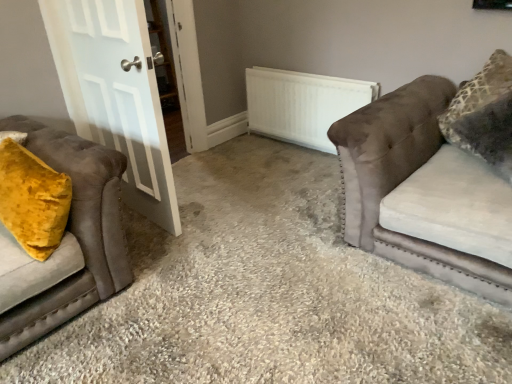
Question: From a real-world perspective, does white matte radiator at center sit lower than velvet mustard pillow at left, the 2th studio couch from the right?

Choices:
 (A) yes
 (B) no

Answer: (A)

Question: Considering the relative positions of white matte radiator at center and velvet mustard pillow at left, the 2th studio couch from the right, in the image provided, is white matte radiator at center to the right of velvet mustard pillow at left, the 2th studio couch from the right, from the viewer's perspective?

Choices:
 (A) yes
 (B) no

Answer: (A)

Question: From a real-world perspective, is white matte radiator at center over velvet mustard pillow at left, the 2th studio couch from the right?

Choices:
 (A) yes
 (B) no

Answer: (B)

Question: Is white matte radiator at center next to velvet mustard pillow at left, the 2th studio couch from the right, and touching it?

Choices:
 (A) no
 (B) yes

Answer: (A)

Question: Can you confirm if white matte radiator at center is taller than velvet mustard pillow at left, the 2th studio couch from the right?

Choices:
 (A) yes
 (B) no

Answer: (B)

Question: Is velvet mustard pillow at left, the 2th studio couch from the right, inside white matte radiator at center?

Choices:
 (A) yes
 (B) no

Answer: (B)

Question: Is velvet yellow pillow at left shorter than velvet mustard pillow at left, marked as the 1th studio couch in a left-to-right arrangement?

Choices:
 (A) yes
 (B) no

Answer: (B)

Question: Does velvet yellow pillow at left have a lesser width compared to velvet mustard pillow at left, the 2th studio couch from the right?

Choices:
 (A) no
 (B) yes

Answer: (B)

Question: Does velvet yellow pillow at left have a larger size compared to velvet mustard pillow at left, the 2th studio couch from the right?

Choices:
 (A) yes
 (B) no

Answer: (B)

Question: Would you say velvet mustard pillow at left, marked as the 1th studio couch in a left-to-right arrangement, is part of velvet yellow pillow at left's contents?

Choices:
 (A) yes
 (B) no

Answer: (B)

Question: Can you confirm if velvet yellow pillow at left is positioned to the right of velvet mustard pillow at left, the 2th studio couch from the right?

Choices:
 (A) no
 (B) yes

Answer: (A)

Question: Is velvet yellow pillow at left further to camera compared to velvet mustard pillow at left, the 2th studio couch from the right?

Choices:
 (A) no
 (B) yes

Answer: (B)

Question: Is white matte radiator at center oriented towards velvet brown couch at right, positioned as the second studio couch in left-to-right order?

Choices:
 (A) no
 (B) yes

Answer: (A)